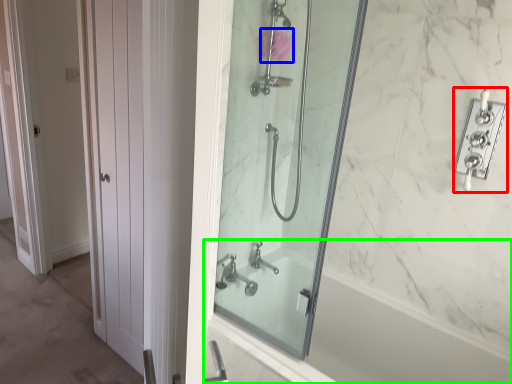
Question: Estimate the real-world distances between objects in this image. Which object is farther from lock (highlighted by a red box), flower (highlighted by a blue box) or bathtub (highlighted by a green box)?

Choices:
 (A) flower
 (B) bathtub

Answer: (B)